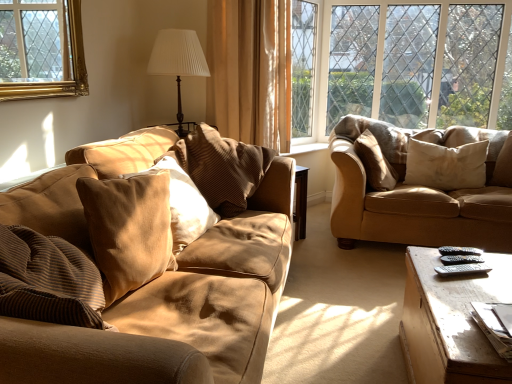
This screenshot has height=384, width=512. Find the location of `empty space that is ontop of wooden coffee table at lower right`. empty space that is ontop of wooden coffee table at lower right is located at coordinates (478, 286).